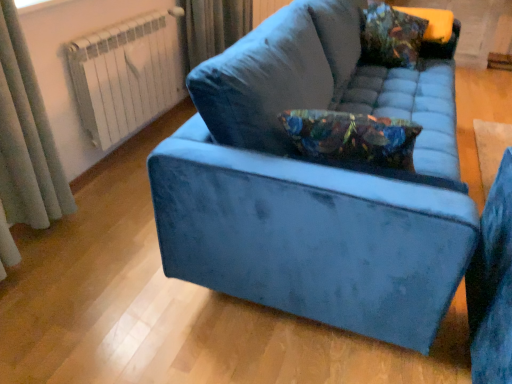
Question: Can you confirm if gray fabric curtain at left is taller than velvet blue couch at center?

Choices:
 (A) yes
 (B) no

Answer: (A)

Question: From the image's perspective, would you say gray fabric curtain at left is shown under velvet blue couch at center?

Choices:
 (A) yes
 (B) no

Answer: (A)

Question: Can you confirm if gray fabric curtain at left is smaller than velvet blue couch at center?

Choices:
 (A) yes
 (B) no

Answer: (A)

Question: Considering the relative sizes of gray fabric curtain at left and velvet blue couch at center in the image provided, is gray fabric curtain at left wider than velvet blue couch at center?

Choices:
 (A) yes
 (B) no

Answer: (B)

Question: Is gray fabric curtain at left next to velvet blue couch at center?

Choices:
 (A) no
 (B) yes

Answer: (A)

Question: Visually, is gray fabric curtain at left positioned to the left or to the right of white metal radiator at upper left?

Choices:
 (A) left
 (B) right

Answer: (A)

Question: From a real-world perspective, relative to white metal radiator at upper left, is gray fabric curtain at left vertically above or below?

Choices:
 (A) above
 (B) below

Answer: (A)

Question: Is gray fabric curtain at left inside the boundaries of white metal radiator at upper left, or outside?

Choices:
 (A) inside
 (B) outside

Answer: (B)

Question: Relative to white metal radiator at upper left, is gray fabric curtain at left in front or behind?

Choices:
 (A) behind
 (B) front

Answer: (B)

Question: Relative to velvet blue couch at center, is white metal radiator at upper left in front or behind?

Choices:
 (A) front
 (B) behind

Answer: (B)

Question: In terms of height, does white metal radiator at upper left look taller or shorter compared to velvet blue couch at center?

Choices:
 (A) tall
 (B) short

Answer: (B)

Question: Based on their positions, is white metal radiator at upper left located to the left or right of velvet blue couch at center?

Choices:
 (A) right
 (B) left

Answer: (B)

Question: Do you think white metal radiator at upper left is within velvet blue couch at center, or outside of it?

Choices:
 (A) outside
 (B) inside

Answer: (A)

Question: Is white metal radiator at upper left bigger or smaller than floral-patterned velvet pillow at upper right?

Choices:
 (A) small
 (B) big

Answer: (B)

Question: Considering the relative positions of white metal radiator at upper left and floral-patterned velvet pillow at upper right in the image provided, is white metal radiator at upper left to the left or to the right of floral-patterned velvet pillow at upper right?

Choices:
 (A) right
 (B) left

Answer: (B)